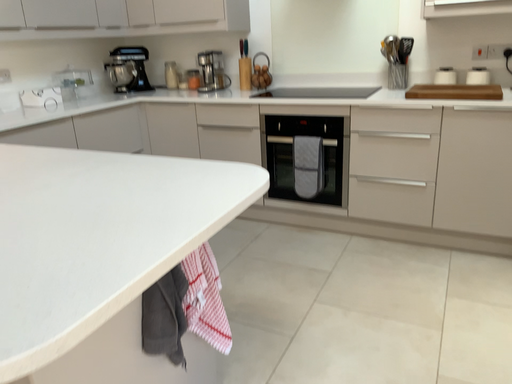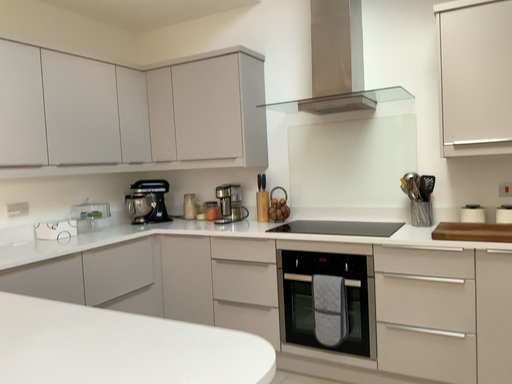
Question: How did the camera likely rotate when shooting the video?

Choices:
 (A) rotated upward
 (B) rotated downward

Answer: (A)